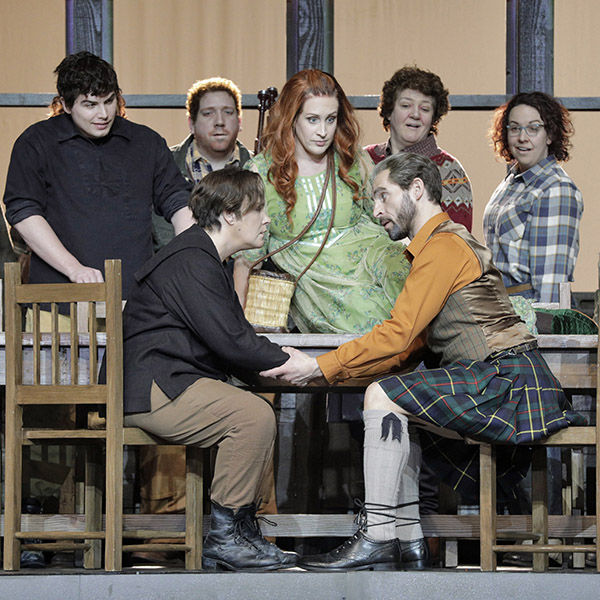
Where is `table`? table is located at coordinates (310, 343).